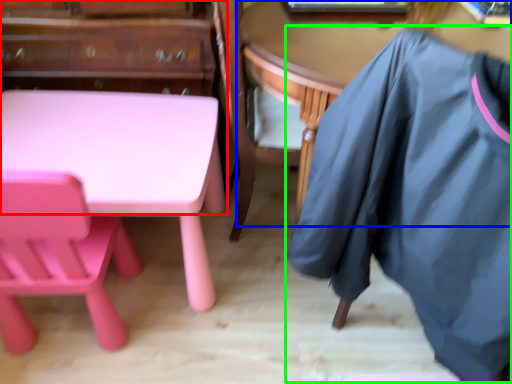
Question: Estimate the real-world distances between objects in this image. Which object is closer to dresser (highlighted by a red box), table (highlighted by a blue box) or clothing (highlighted by a green box)?

Choices:
 (A) table
 (B) clothing

Answer: (A)